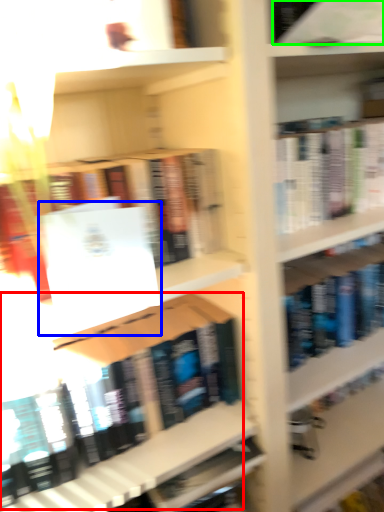
Question: Which is farther away from book (highlighted by a red box)? paperback book (highlighted by a blue box) or book (highlighted by a green box)?

Choices:
 (A) paperback book
 (B) book

Answer: (B)